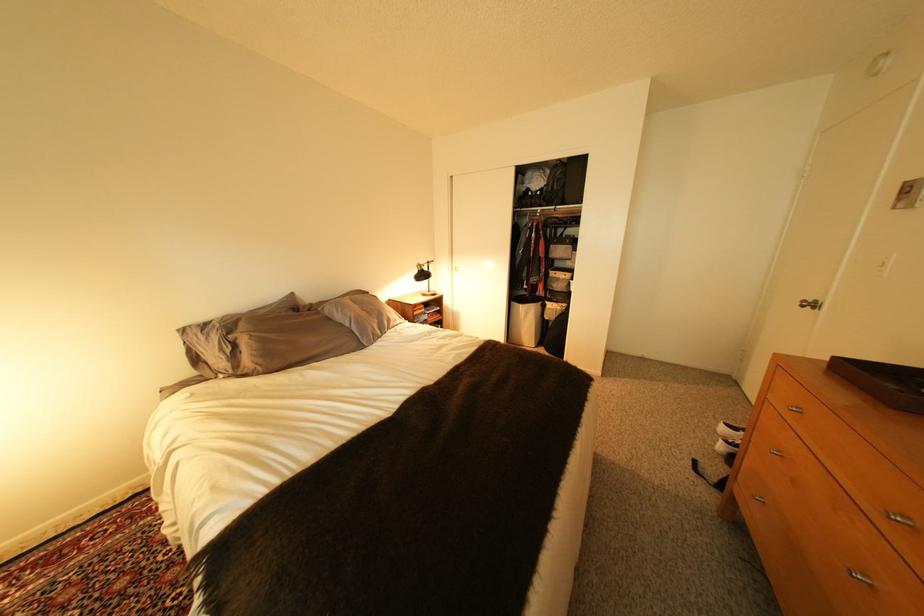
Find where to lift the brown wooden tray. Please return your answer as a coordinate pair (x, y).

(882, 381)